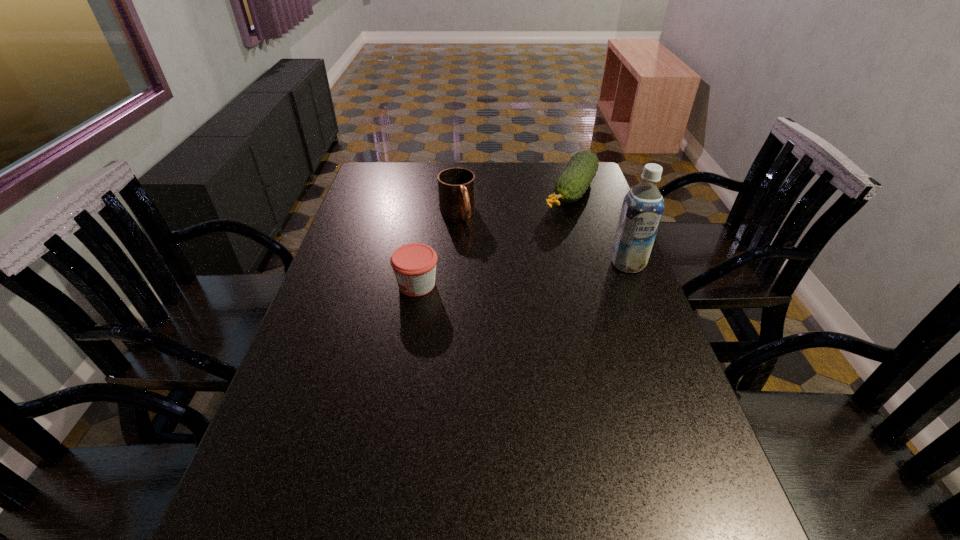
At what (x,y) coordinates should I click in order to perform the action: click on vacant spot on the desktop that is between the jam and the tallest object and is positioned at the blossom end of the cucumber. Please return your answer as a coordinate pair (x, y). The image size is (960, 540). Looking at the image, I should click on (510, 275).

Where is `free space on the desktop that is between the jam and the soya milk and is positioned on the side of the mug with the handle`? The image size is (960, 540). free space on the desktop that is between the jam and the soya milk and is positioned on the side of the mug with the handle is located at coordinates (493, 277).